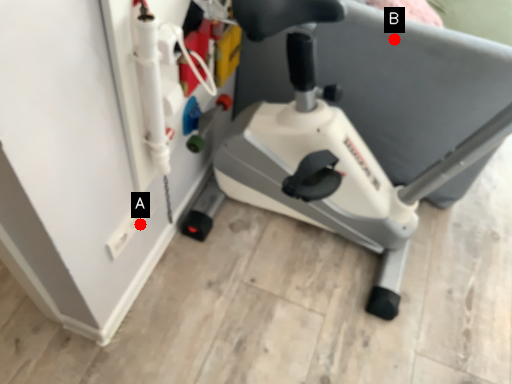
Question: Two points are circled on the image, labeled by A and B beside each circle. Which point is further to the camera?

Choices:
 (A) A is further
 (B) B is further

Answer: (B)